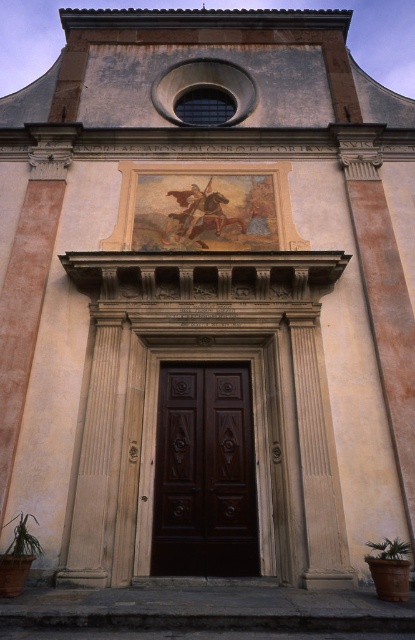
Question: In this image, where is green leafy plant at lower left located relative to green leafy plant at lower right?

Choices:
 (A) above
 (B) below

Answer: (A)

Question: Which object appears farthest from the camera in this image?

Choices:
 (A) green leafy plant at lower right
 (B) dark wood door at center

Answer: (B)

Question: Which point is closer to the camera?

Choices:
 (A) (158, 496)
 (B) (26, 554)
 (C) (393, 538)

Answer: (B)

Question: Does dark wood door at center have a larger size compared to green leafy plant at lower left?

Choices:
 (A) yes
 (B) no

Answer: (A)

Question: Is green leafy plant at lower left bigger than green leafy plant at lower right?

Choices:
 (A) yes
 (B) no

Answer: (A)

Question: Estimate the real-world distances between objects in this image. Which object is farther from the green leafy plant at lower left?

Choices:
 (A) dark wood door at center
 (B) green leafy plant at lower right

Answer: (B)